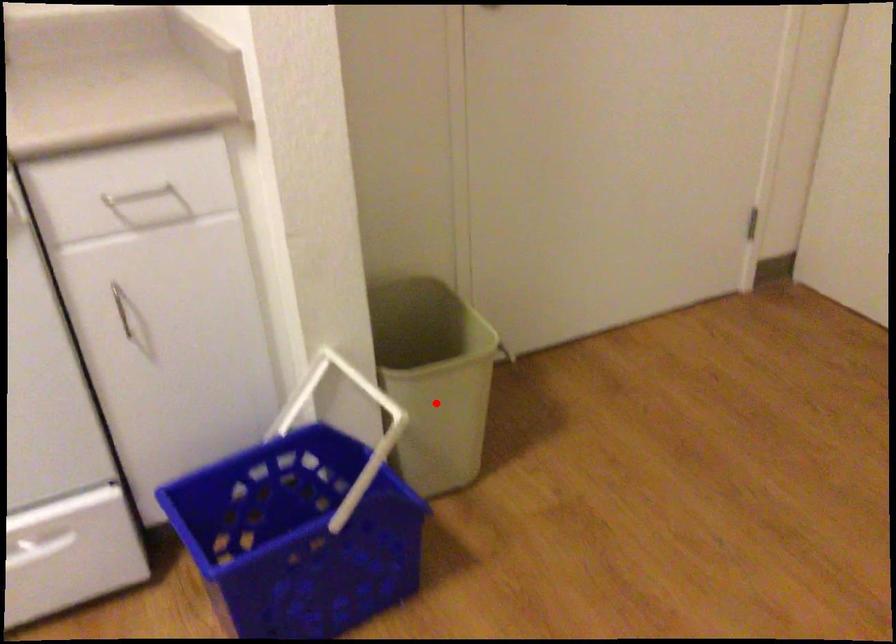
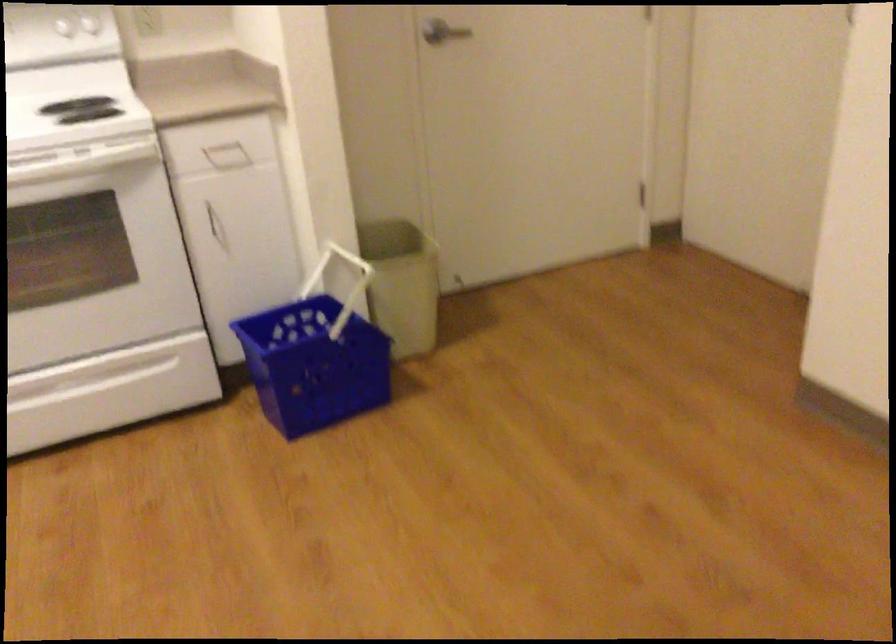
Where in the second image is the point corresponding to the highlighted location from the first image?

(401, 283)